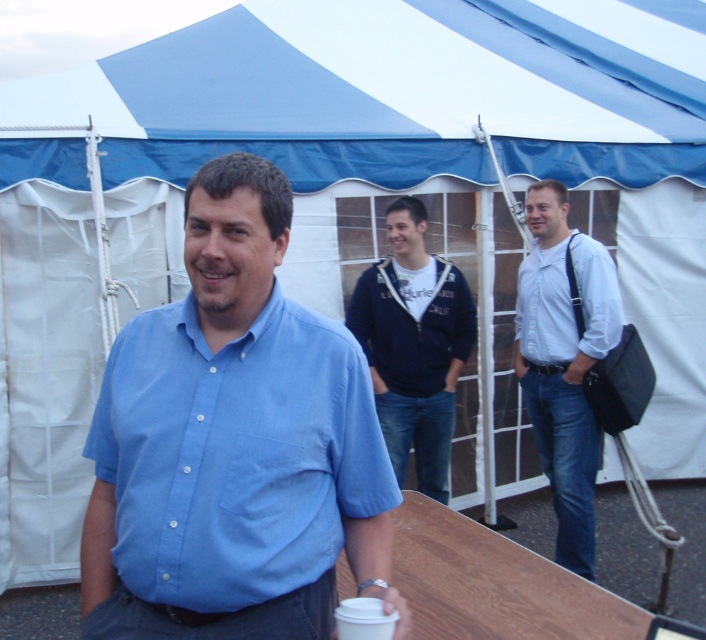
Question: Is dark blue zip-up jacket at center wider than white paper cup at lower center?

Choices:
 (A) no
 (B) yes

Answer: (B)

Question: Which object is farther from the camera taking this photo?

Choices:
 (A) white paper cup at lower center
 (B) matte blue shirt at center
 (C) white matte shirt at right

Answer: (C)

Question: Which of the following is the farthest from the observer?

Choices:
 (A) matte blue shirt at center
 (B) white matte shirt at right

Answer: (B)

Question: Among these objects, which one is farthest from the camera?

Choices:
 (A) white paper cup at lower center
 (B) white matte shirt at right
 (C) matte blue shirt at center

Answer: (B)

Question: Does dark blue zip-up jacket at center appear under white matte shirt at right?

Choices:
 (A) yes
 (B) no

Answer: (A)

Question: Where is matte blue shirt at center located in relation to wooden table at lower center in the image?

Choices:
 (A) below
 (B) above

Answer: (B)